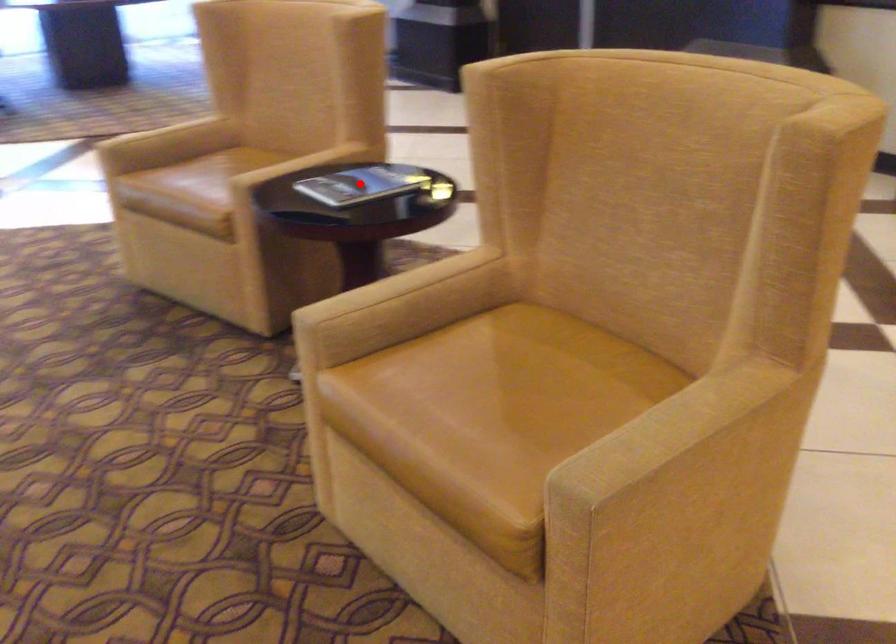
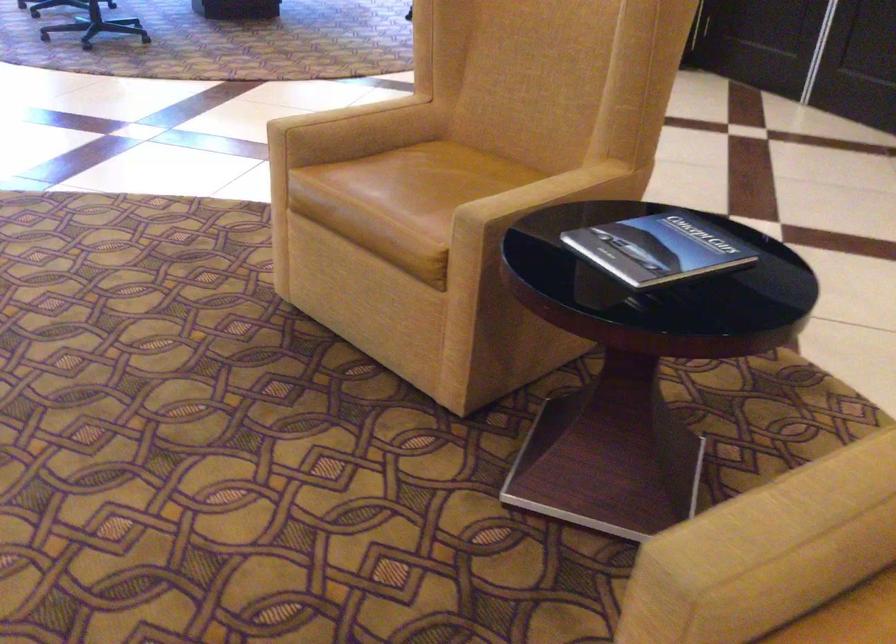
Locate, in the second image, the point that corresponds to the highlighted location in the first image.

(657, 249)